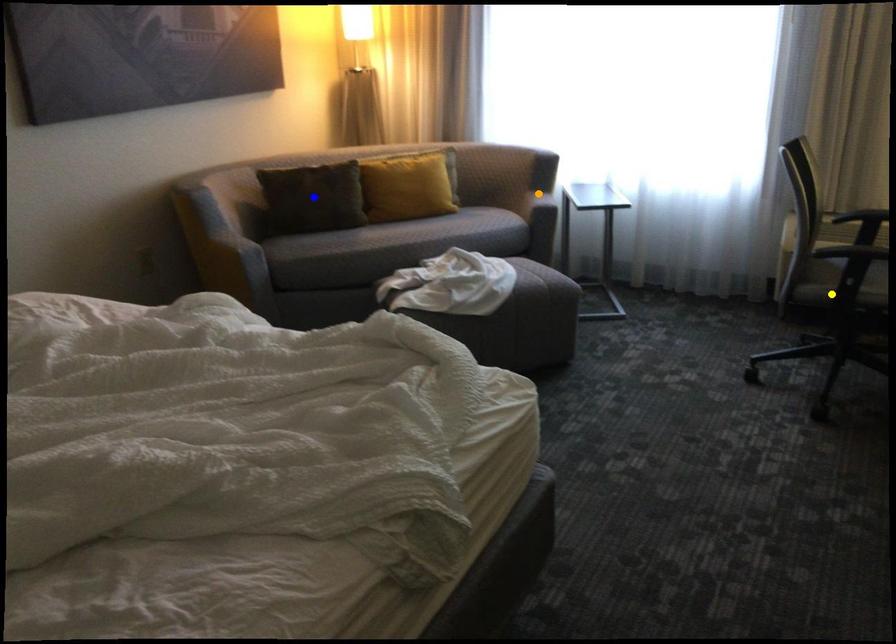
Order these from nearest to farthest:
A) blue point
B) yellow point
C) orange point

yellow point
blue point
orange point